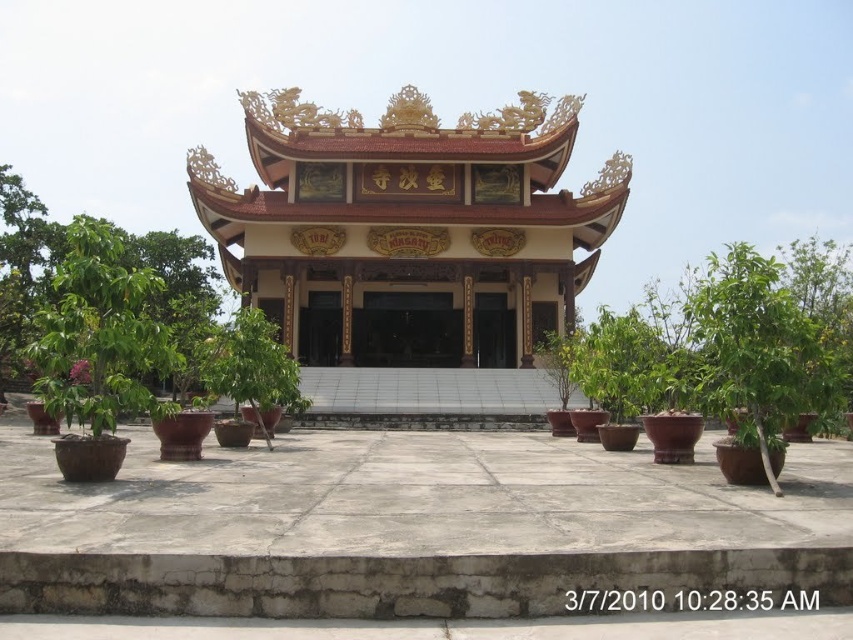
You are a visitor standing at the entrance of the temple. You want to walk from the entrance to the white glossy pagoda at center. Is the green leafy tree at left blocking your path? Please explain your reasoning based on the distance between them.

The white glossy pagoda at center and green leafy tree at left are 30.60 meters apart. Since the distance between them is quite large, the green leafy tree at left is not blocking the path to the white glossy pagoda at center.

You are standing in front of the traditional East Asian building and see the green glossy tree at center and the green leafy tree at left. Which tree is closer to the entrance of the building?

The green leafy tree at left is closer to the entrance of the building because it is positioned to the left of the green glossy tree at center, which is further to the right.

You are standing at the entrance of the traditional East Asian building and want to walk directly to the green glossy tree at center. However, there is a white glossy pagoda at center in your path. Can you walk straight to the tree without going around the pagoda?

The white glossy pagoda at center is 28.52 meters away from the green glossy tree at center, so you can walk straight to the green glossy tree at center without needing to go around the pagoda since they are not in the same location.